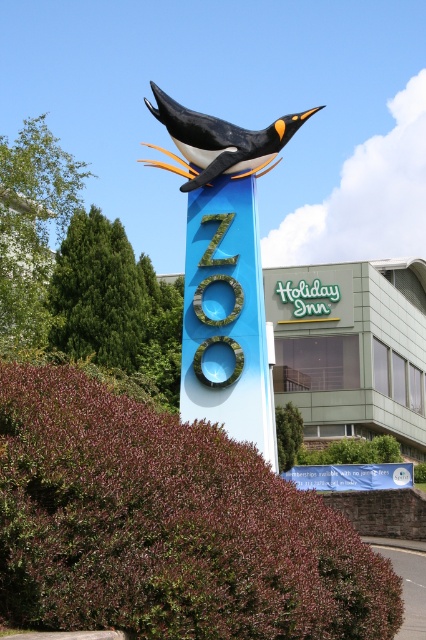
Question: Does blue painted wood sign at center have a smaller size compared to polished blue penguin at center?

Choices:
 (A) yes
 (B) no

Answer: (A)

Question: Can you confirm if matte blue penguin at center is positioned to the left of blue painted wood sign at center?

Choices:
 (A) yes
 (B) no

Answer: (A)

Question: Which is farther from the polished blue penguin at center?

Choices:
 (A) blue fabric banner at center
 (B) matte blue penguin at center
 (C) blue painted wood sign at center

Answer: (A)

Question: Which object is the farthest from the blue fabric banner at center?

Choices:
 (A) matte blue penguin at center
 (B) blue painted wood sign at center
 (C) polished blue penguin at center

Answer: (C)

Question: Can you confirm if blue painted wood sign at center is positioned below polished blue penguin at center?

Choices:
 (A) no
 (B) yes

Answer: (B)

Question: Considering the real-world distances, which object is farthest from the blue fabric banner at center?

Choices:
 (A) matte blue penguin at center
 (B) blue painted wood sign at center
 (C) polished blue penguin at center

Answer: (C)